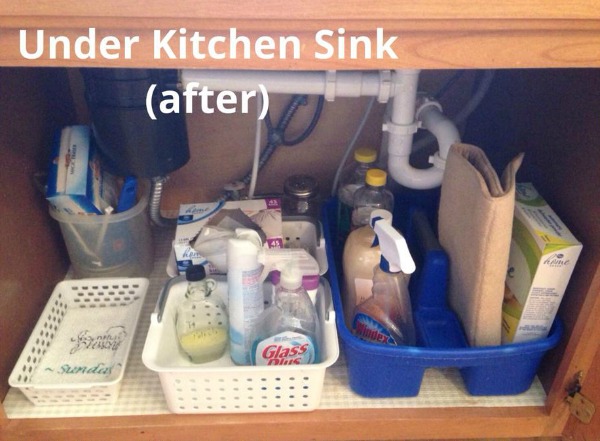
Locate an element on the screen. The image size is (600, 441). white sink pipe is located at coordinates click(x=408, y=123).